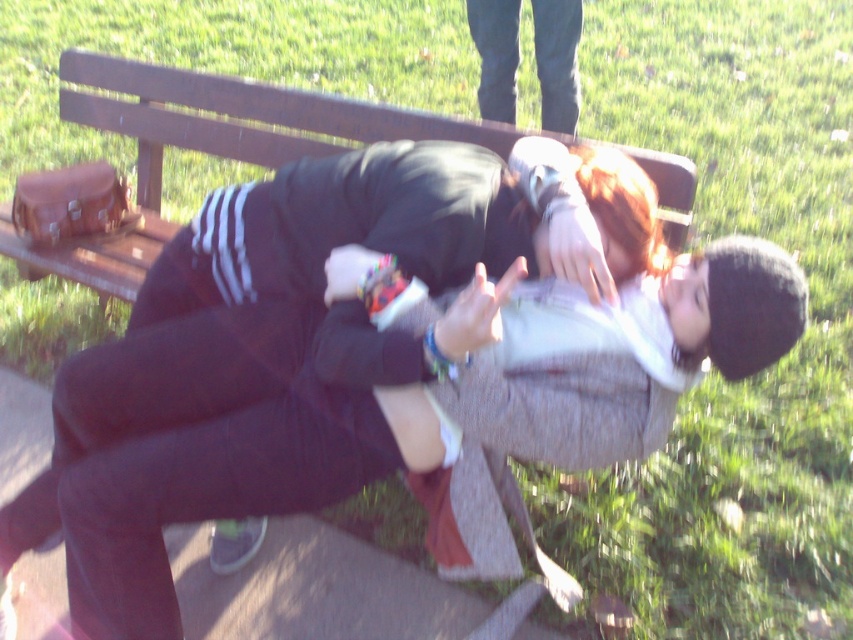
You are a photographer trying to capture a candid shot of the dark blue jeans at upper center. Since the wooden bench at center is blocking your view, can you move around it to get a clear shot?

The wooden bench at center is in front of the dark blue jeans at upper center, so moving around the bench might allow you to see the jeans. However, the bench is blocking the direct line of sight, so you would need to position yourself to the side or behind the bench to capture the jeans without obstruction.

You are a photographer setting up a shoot in a park. You need to place a small tripod between the wooden bench at center and the dark blue jeans at upper center. Which object should the tripod be closer to to ensure it fits within the frame?

The wooden bench at center is larger in size than the dark blue jeans at upper center, so the tripod should be placed closer to the dark blue jeans at upper center to ensure it fits within the frame.